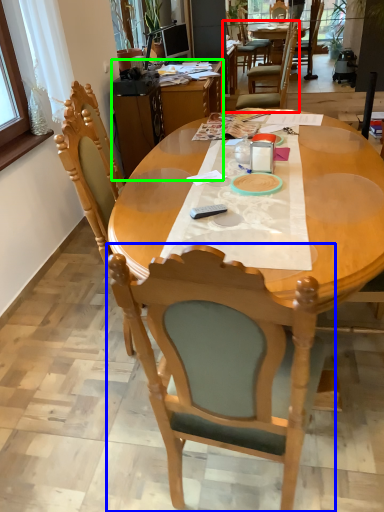
Question: Estimate the real-world distances between objects in this image. Which object is farther from chair (highlighted by a red box), chair (highlighted by a blue box) or desk (highlighted by a green box)?

Choices:
 (A) chair
 (B) desk

Answer: (A)